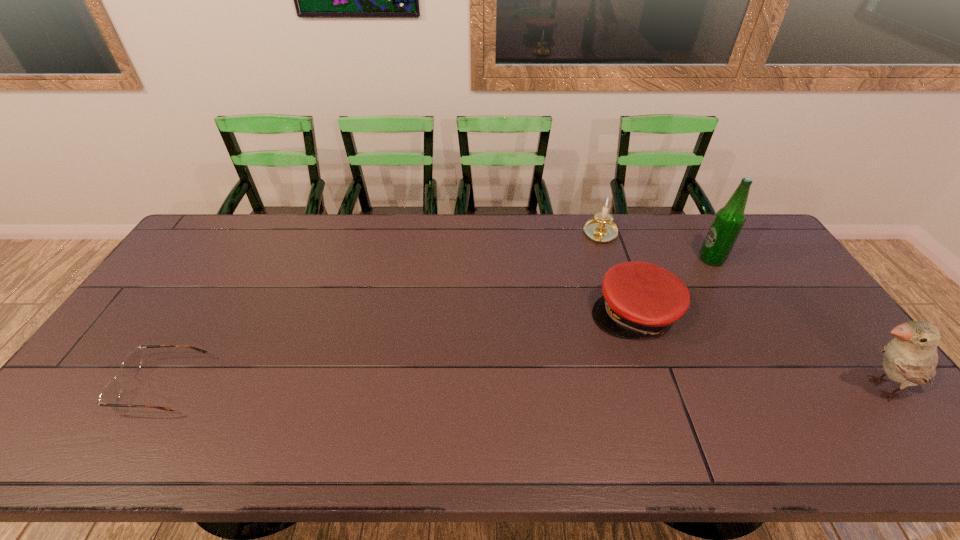
Locate an element on the screen. The image size is (960, 540). the leftmost object is located at coordinates (110, 394).

You are a GUI agent. You are given a task and a screenshot of the screen. Output one action in this format:
    pyautogui.click(x=<x>, y=<y>)
    Task: Click on the shortest object
    The image size is (960, 540).
    Given the screenshot: What is the action you would take?
    pyautogui.click(x=110, y=394)

Locate an element on the screen. The height and width of the screenshot is (540, 960). bird is located at coordinates (910, 359).

Locate an element on the screen. This screenshot has height=540, width=960. the fourth shortest object is located at coordinates (910, 359).

Locate an element on the screen. The width and height of the screenshot is (960, 540). cap is located at coordinates (x=639, y=298).

The image size is (960, 540). Identify the location of the third farthest object. (639, 298).

The image size is (960, 540). What are the coordinates of `the third shortest object` in the screenshot? It's located at (601, 228).

Where is `the farthest object`? Image resolution: width=960 pixels, height=540 pixels. the farthest object is located at coordinates (x=601, y=228).

Where is `the second object from right to left`? the second object from right to left is located at coordinates (726, 226).

At what (x,y) coordinates should I click in order to perform the action: click on beer bottle. Please return your answer as a coordinate pair (x, y). The width and height of the screenshot is (960, 540). Looking at the image, I should click on (726, 226).